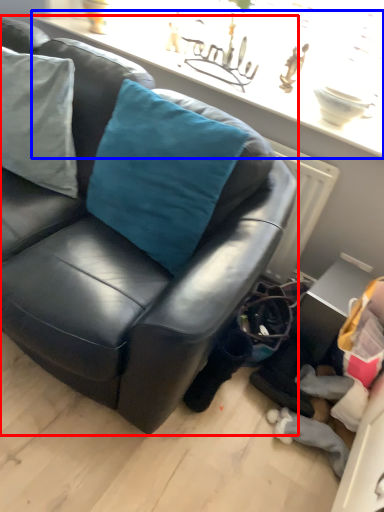
Question: Which object appears farthest to the camera in this image, studio couch (highlighted by a red box) or window sill (highlighted by a blue box)?

Choices:
 (A) studio couch
 (B) window sill

Answer: (B)